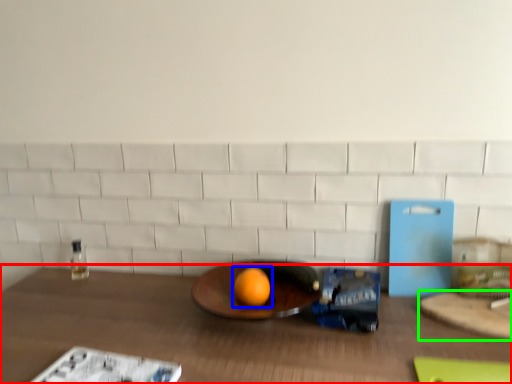
Question: Estimate the real-world distances between objects in this image. Which object is closer to table (highlighted by a red box), grapefruit (highlighted by a blue box) or cutting board (highlighted by a green box)?

Choices:
 (A) grapefruit
 (B) cutting board

Answer: (A)